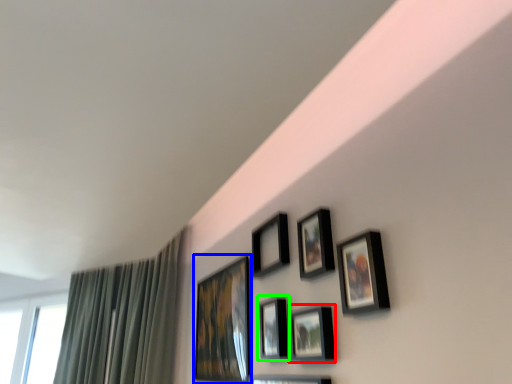
Question: Which object is positioned closest to picture frame (highlighted by a red box)? Select from picture frame (highlighted by a blue box) and picture frame (highlighted by a green box).

Choices:
 (A) picture frame
 (B) picture frame

Answer: (B)